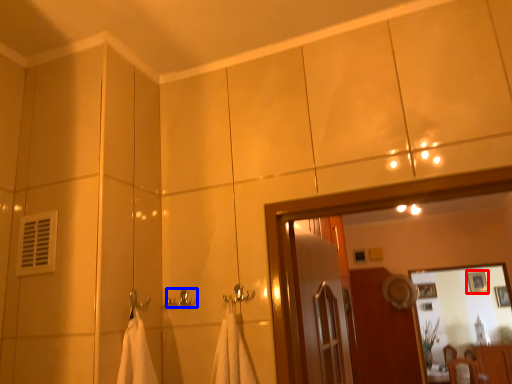
Question: Which object is closer to the camera taking this photo, picture frame (highlighted by a red box) or towel bar (highlighted by a blue box)?

Choices:
 (A) picture frame
 (B) towel bar

Answer: (B)